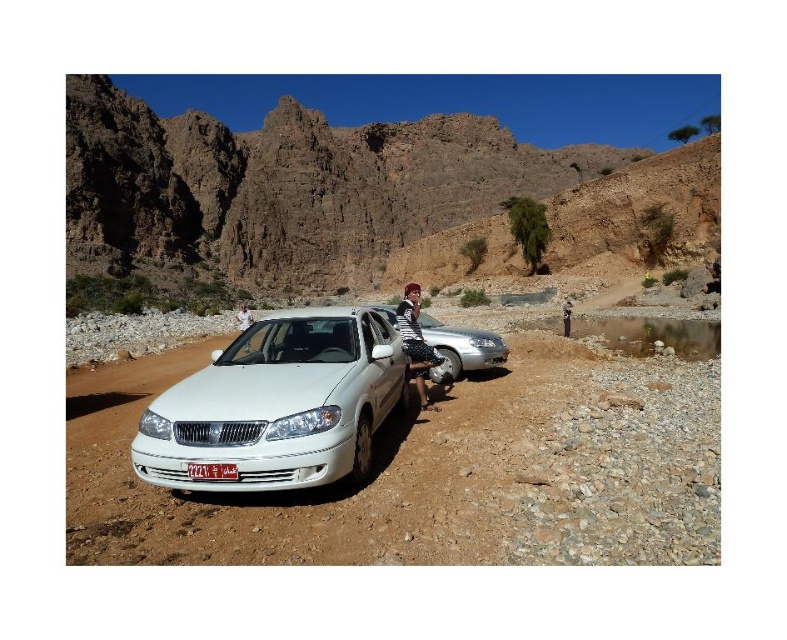
Which is in front, point (534, 516) or point (374, 308)?

Point (534, 516) is in front.

Can you confirm if smooth gravel dirt at center is thinner than silver metallic car at center?

No, smooth gravel dirt at center is not thinner than silver metallic car at center.

Locate an element on the screen. Image resolution: width=787 pixels, height=640 pixels. smooth gravel dirt at center is located at coordinates (436, 474).

Which is more to the right, white plastic license plate at center or brown leather jacket at lower right?

From the viewer's perspective, brown leather jacket at lower right appears more on the right side.

Can you confirm if white plastic license plate at center is bigger than brown leather jacket at lower right?

No.

The width and height of the screenshot is (787, 640). Identify the location of white plastic license plate at center. (211, 472).

This screenshot has height=640, width=787. What are the coordinates of `white plastic license plate at center` in the screenshot? It's located at (211, 472).

The width and height of the screenshot is (787, 640). What do you see at coordinates (462, 346) in the screenshot? I see `silver metallic car at center` at bounding box center [462, 346].

Is silver metallic car at center taller than striped fabric shirt at center?

No, silver metallic car at center is not taller than striped fabric shirt at center.

Which is in front, point (427, 323) or point (414, 369)?

Point (414, 369) is in front.

This screenshot has width=787, height=640. I want to click on silver metallic car at center, so (462, 346).